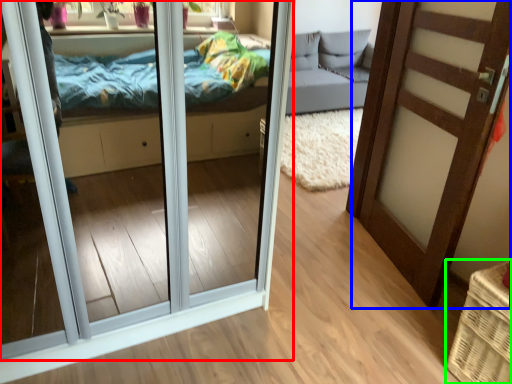
Question: Which object is the closest to the door (highlighted by a red box)? Choose among these: door (highlighted by a blue box) or basket (highlighted by a green box).

Choices:
 (A) door
 (B) basket

Answer: (A)